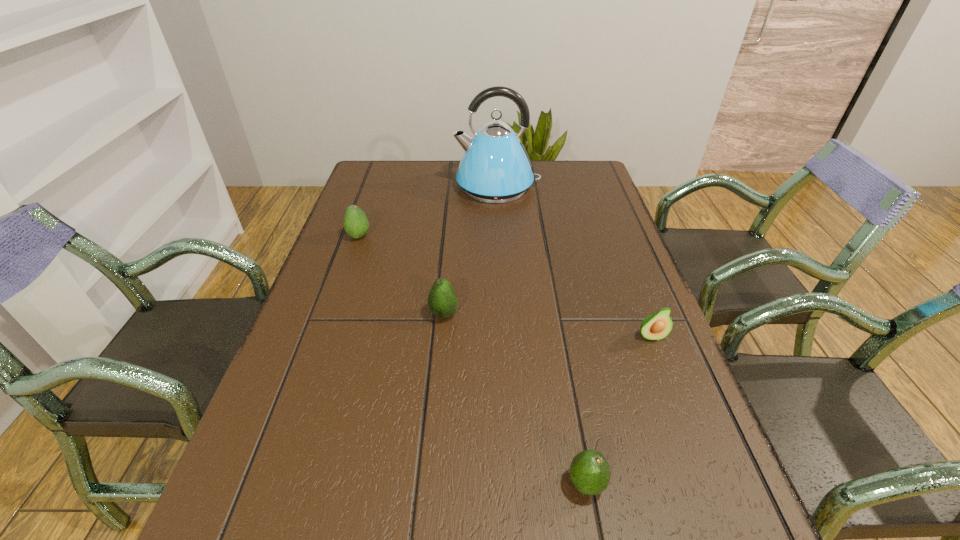
You are a GUI agent. You are given a task and a screenshot of the screen. Output one action in this format:
    pyautogui.click(x=<x>, y=<y>)
    Task: Click on the free space between the nearest avocado and the third avocado from right to left
    The image size is (960, 540).
    Given the screenshot: What is the action you would take?
    pyautogui.click(x=516, y=399)

The height and width of the screenshot is (540, 960). What are the coordinates of `vacant space that's between the kettle and the third nearest object` in the screenshot? It's located at (470, 250).

Locate an element on the screen. This screenshot has height=540, width=960. empty space that is in between the third avocado from left to right and the farthest object is located at coordinates (541, 335).

Point out which object is positioned as the fourth nearest to the second avocado from right to left. Please provide its 2D coordinates. Your answer should be formatted as a tuple, i.e. [(x, y)], where the tuple contains the x and y coordinates of a point satisfying the conditions above.

[(495, 168)]

Find the location of `the fourth closest object to the kettle`. the fourth closest object to the kettle is located at coordinates 590,473.

Identify the location of the second closest avocado relative to the tallest object. (442, 300).

Select which avocado is the closest to the kettle. Please provide its 2D coordinates. Your answer should be formatted as a tuple, i.e. [(x, y)], where the tuple contains the x and y coordinates of a point satisfying the conditions above.

[(356, 224)]

Where is `free point that satisfies the following two spatial constraints: 1. at the spout of the nearest avocado; 2. on the left side of the farthest object`? Image resolution: width=960 pixels, height=540 pixels. free point that satisfies the following two spatial constraints: 1. at the spout of the nearest avocado; 2. on the left side of the farthest object is located at coordinates (x=515, y=483).

This screenshot has height=540, width=960. I want to click on free location that satisfies the following two spatial constraints: 1. on the front side of the nearest avocado; 2. on the right side of the third nearest avocado, so click(x=429, y=483).